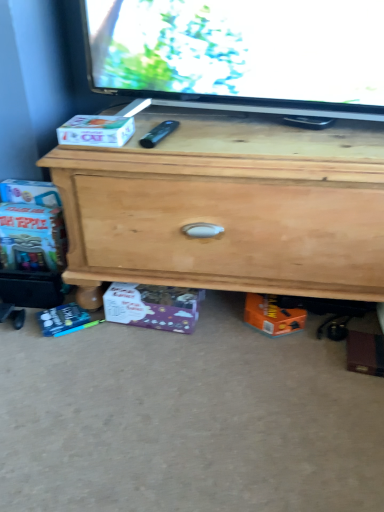
Find the location of a particular element. empty space that is ontop of purple cardboard box at lower center, acting as the first box starting from the back (from a real-world perspective) is located at coordinates (147, 295).